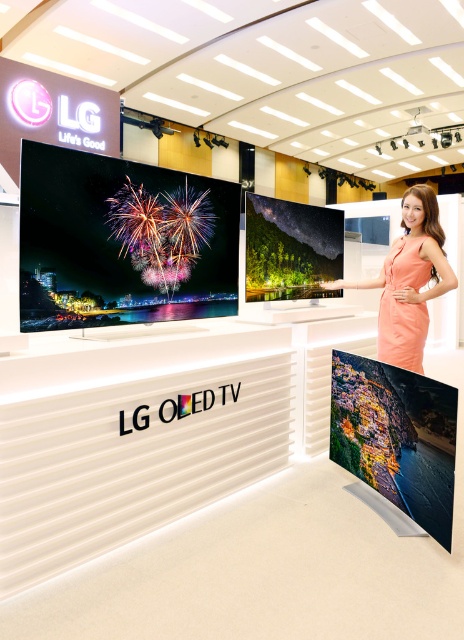
Does orange satin dress at upper right appear on the left side of orange satin dress at right?

No, orange satin dress at upper right is not to the left of orange satin dress at right.

From the picture: Between orange satin dress at upper right and orange satin dress at right, which one is positioned higher?

orange satin dress at upper right is above.

Is point (408, 276) behind point (417, 330)?

Yes, it is.

The height and width of the screenshot is (640, 464). Find the location of `orange satin dress at upper right`. orange satin dress at upper right is located at coordinates (408, 280).